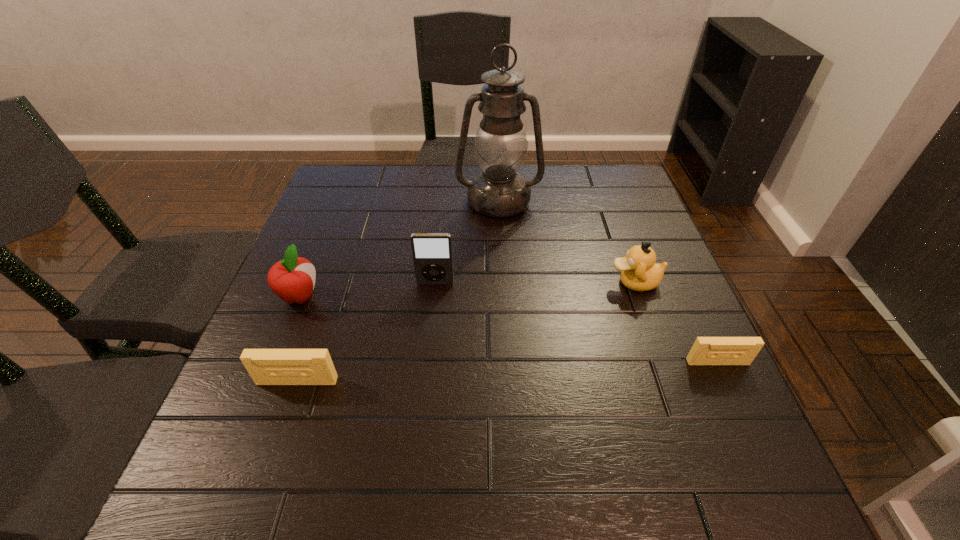
You are a GUI agent. You are given a task and a screenshot of the screen. Output one action in this format:
    pyautogui.click(x=<x>, y=<y>)
    Task: Click on the free location located 0.050m at the front of the farther videotape with spools
    
    Given the screenshot: What is the action you would take?
    pyautogui.click(x=731, y=389)

The height and width of the screenshot is (540, 960). Identify the location of free point located 0.290m on the front of the farthest object. (504, 299).

This screenshot has width=960, height=540. Find the location of `free space located 0.260m on the front-facing side of the iPod`. free space located 0.260m on the front-facing side of the iPod is located at coordinates (425, 383).

Locate an element on the screen. free space located 0.120m on the face of the duckling is located at coordinates (557, 282).

Locate an element on the screen. Image resolution: width=960 pixels, height=540 pixels. vacant space located 0.200m on the face of the duckling is located at coordinates (522, 282).

Identify the location of vacant space situated 0.050m on the face of the duckling. (588, 282).

The height and width of the screenshot is (540, 960). I want to click on free space located 0.130m on the front of the apple, so click(x=273, y=363).

Where is `object located in the far edge section of the desktop`? The width and height of the screenshot is (960, 540). object located in the far edge section of the desktop is located at coordinates (501, 144).

Identify the location of videotape that is at the left edge. The image size is (960, 540). (266, 366).

Locate an element on the screen. apple that is at the left edge is located at coordinates (292, 279).